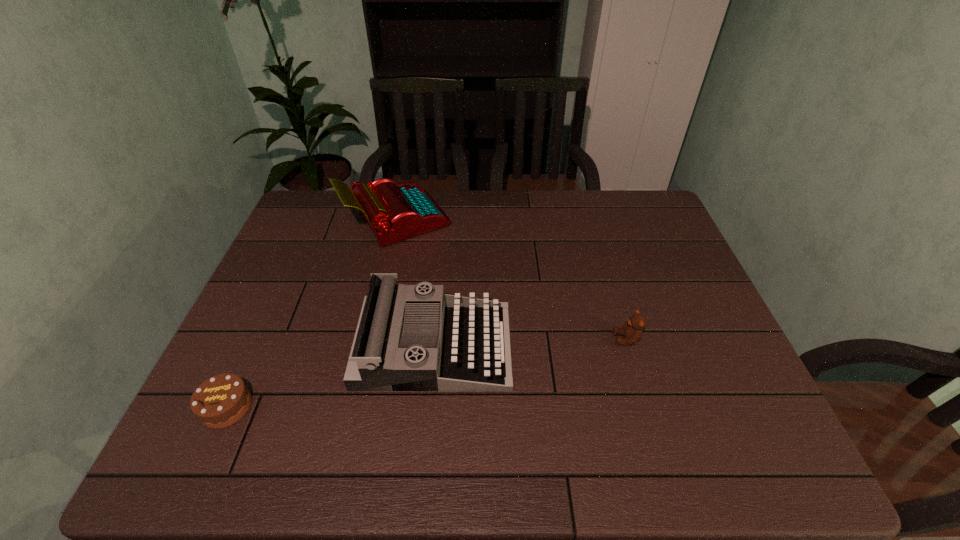
At what (x,y) coordinates should I click in order to perform the action: click on vacant space located on the face of the teddy bear. Please return your answer as a coordinate pair (x, y). Looking at the image, I should click on (569, 339).

This screenshot has width=960, height=540. I want to click on vacant space located on the back of the leftmost object, so click(289, 269).

This screenshot has width=960, height=540. Identify the location of object at the far edge. (394, 212).

In order to click on object that is at the near edge in this screenshot , I will do `click(222, 400)`.

The height and width of the screenshot is (540, 960). Find the location of `typewriter at the left edge`. typewriter at the left edge is located at coordinates (394, 212).

Locate an element on the screen. chocolate cake located in the left edge section of the desktop is located at coordinates (222, 400).

At what (x,y) coordinates should I click in order to perform the action: click on object located in the far left corner section of the desktop. Please return your answer as a coordinate pair (x, y). The image size is (960, 540). Looking at the image, I should click on (394, 212).

Locate an element on the screen. The image size is (960, 540). object that is positioned at the near left corner is located at coordinates (222, 400).

In the image, there is a desktop. Where is `vacant region at the far edge`? The height and width of the screenshot is (540, 960). vacant region at the far edge is located at coordinates (604, 197).

In the image, there is a desktop. Where is `free space at the near edge`? Image resolution: width=960 pixels, height=540 pixels. free space at the near edge is located at coordinates (487, 469).